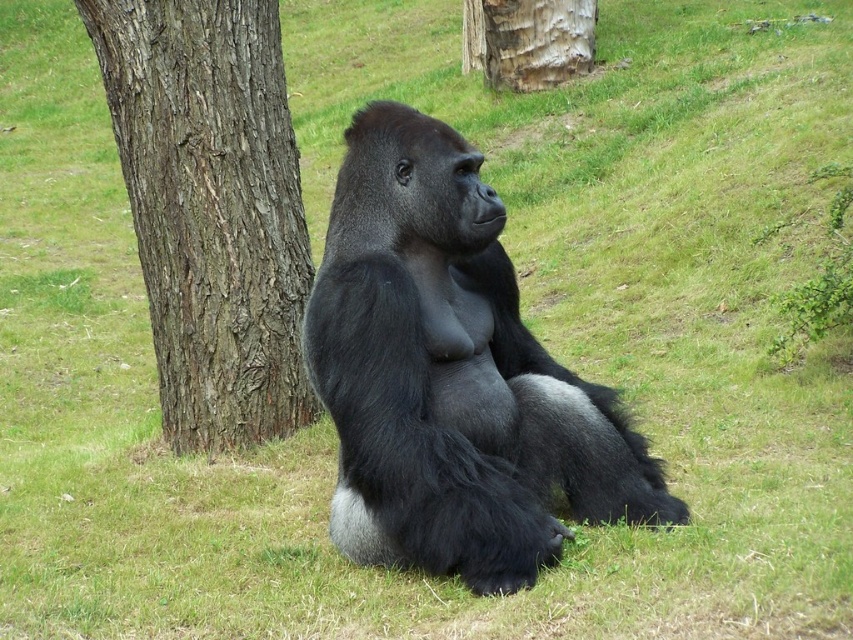
Is shiny black fur at center below gray textured bark at center?

Yes, shiny black fur at center is below gray textured bark at center.

Locate an element on the screen. This screenshot has height=640, width=853. shiny black fur at center is located at coordinates (451, 376).

Is point (554, 518) positioned behind point (579, 35)?

No, (554, 518) is in front of (579, 35).

Where is `shiny black fur at center`? shiny black fur at center is located at coordinates (451, 376).

Which is behind, point (265, 145) or point (537, 74)?

The point (537, 74) is behind.

Measure the distance between brown rough bark tree at left and gray textured bark at center.

brown rough bark tree at left and gray textured bark at center are 6.19 meters apart.

Does point (270, 291) come farther from viewer compared to point (548, 60)?

No.

This screenshot has width=853, height=640. I want to click on brown rough bark tree at left, so click(x=212, y=209).

Between shiny black fur at center and brown rough bark tree at left, which one appears on the right side from the viewer's perspective?

Positioned to the right is shiny black fur at center.

Is point (323, 291) farther from viewer compared to point (154, 262)?

No, it is not.

Locate an element on the screen. shiny black fur at center is located at coordinates (451, 376).